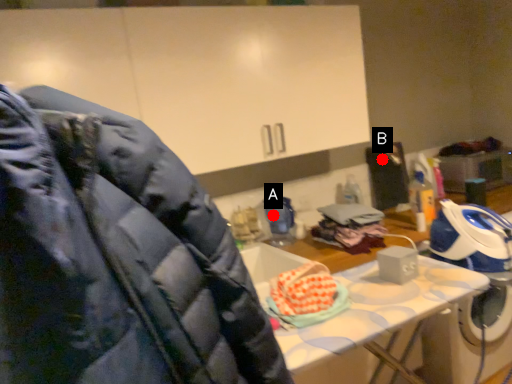
Question: Two points are circled on the image, labeled by A and B beside each circle. Which point is closer to the camera?

Choices:
 (A) A is closer
 (B) B is closer

Answer: (A)